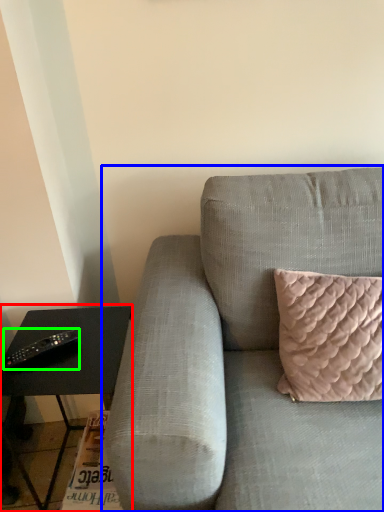
Question: Which object is positioned closest to table (highlighted by a red box)? Select from studio couch (highlighted by a blue box) and remote (highlighted by a green box).

Choices:
 (A) studio couch
 (B) remote

Answer: (B)